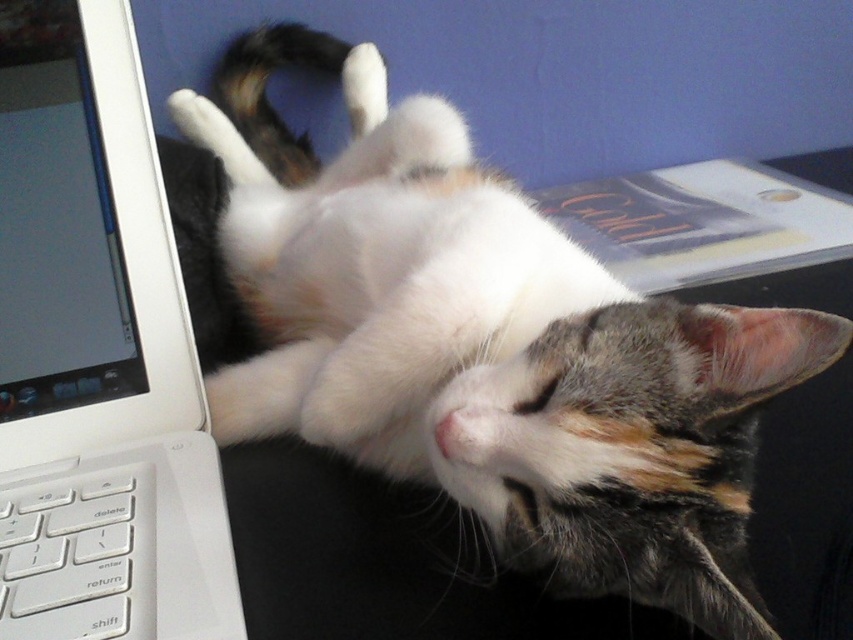
Who is more forward, (9, 241) or (44, 634)?

Positioned in front is point (44, 634).

Image resolution: width=853 pixels, height=640 pixels. What are the coordinates of `white plastic laptop at left` in the screenshot? It's located at (96, 353).